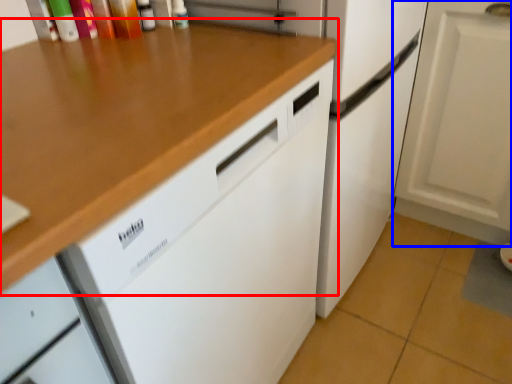
Question: Which object appears farthest to the camera in this image, countertop (highlighted by a red box) or cabinetry (highlighted by a blue box)?

Choices:
 (A) countertop
 (B) cabinetry

Answer: (B)